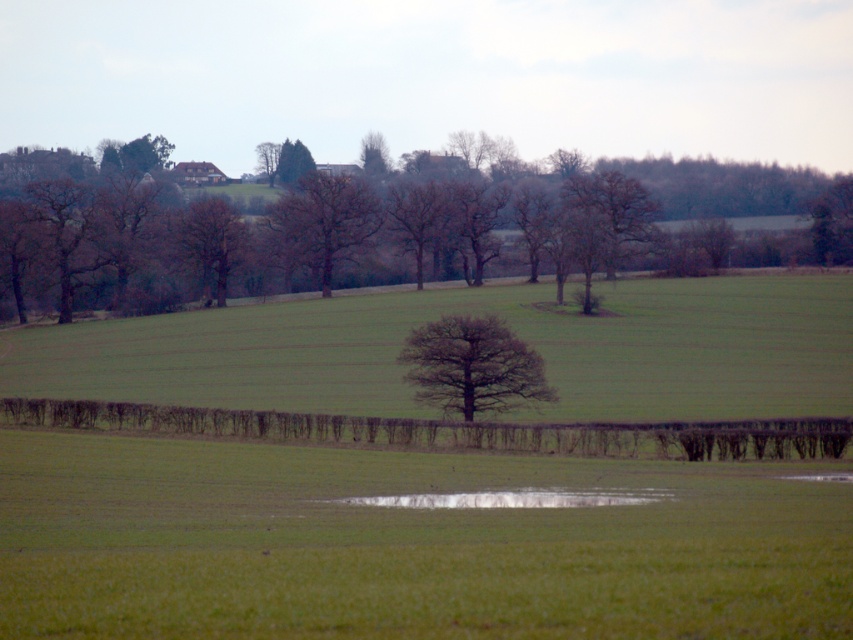
Question: In this image, where is bare brown tree at center located relative to brown textured tree at center-left?

Choices:
 (A) right
 (B) left

Answer: (A)

Question: Estimate the real-world distances between objects in this image. Which object is closer to the brown leafless tree at upper center?

Choices:
 (A) dark brown textured tree at center
 (B) green leafy tree at upper center

Answer: (B)

Question: Which point appears farthest from the camera in this image?

Choices:
 (A) click(x=194, y=273)
 (B) click(x=480, y=320)
 (C) click(x=339, y=243)

Answer: (C)

Question: Which of the following is the closest to the observer?

Choices:
 (A) brown textured tree at center-left
 (B) dark brown textured tree at center

Answer: (B)

Question: Is brown leafless tree at upper center thinner than green leafy tree at upper center?

Choices:
 (A) yes
 (B) no

Answer: (B)

Question: From the image, what is the correct spatial relationship of brown textured tree at center-left in relation to green leafy tree at upper center?

Choices:
 (A) right
 (B) left

Answer: (B)